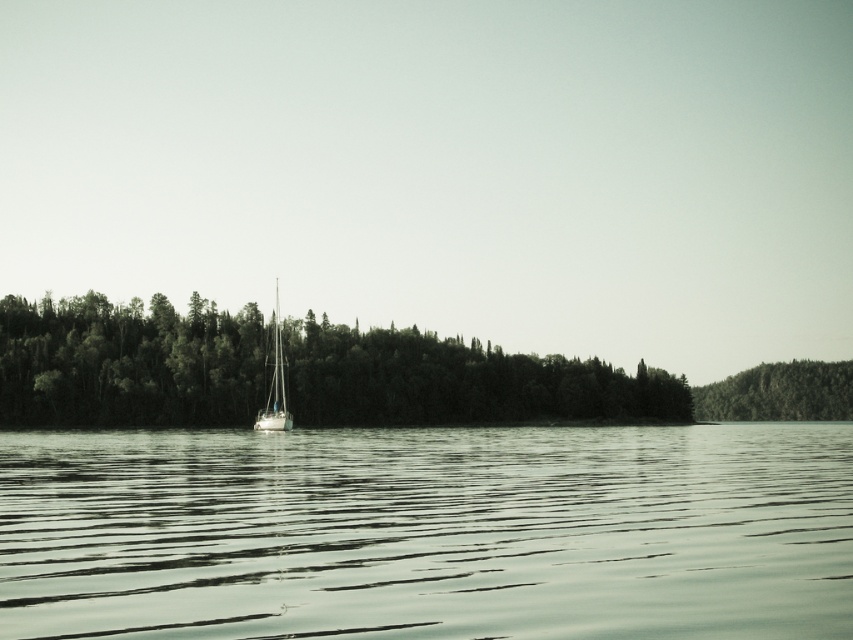
You are standing at the lakeside and want to take a photo. You notice the clear water at center and the green textured forest at right. Which area should you focus on if you want to capture the widest part of the scene?

You should focus on the clear water at center because its width is larger than the green textured forest at right, making it the wider area to capture.

You are a photographer planning to take a photo of the white glossy sailboat at center and the green matte trees at center. Based on the scene, which object is positioned farther away from the camera?

The white glossy sailboat at center is positioned farther away from the camera than the green matte trees at center because it is described as being behind the trees.